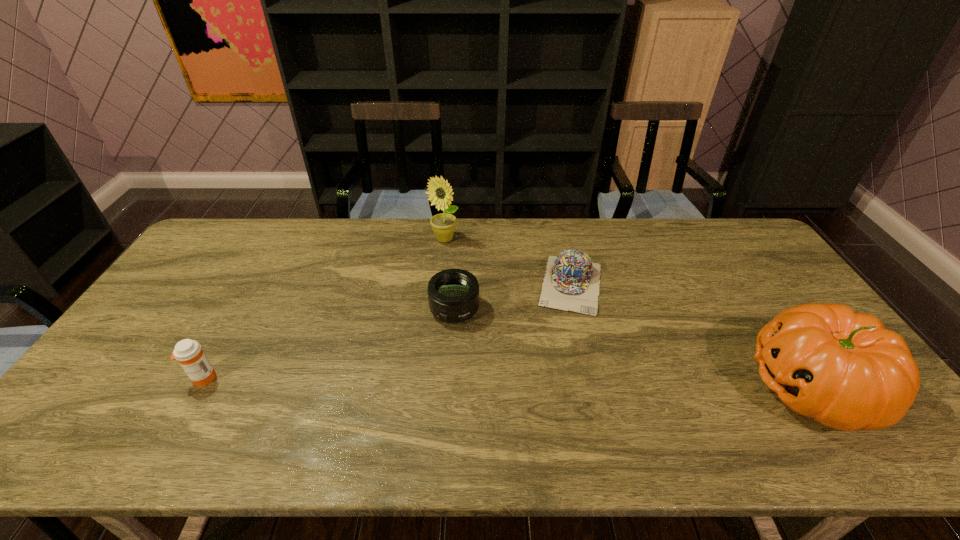
The width and height of the screenshot is (960, 540). I want to click on vacant space situated on the face of the farthest object, so click(443, 303).

Image resolution: width=960 pixels, height=540 pixels. In order to click on cap at the far edge in this screenshot , I will do `click(571, 283)`.

Where is `sunflower present at the far edge`? This screenshot has height=540, width=960. sunflower present at the far edge is located at coordinates (440, 193).

What are the coordinates of `medicine situated at the near edge` in the screenshot? It's located at (189, 353).

Where is `pumpkin positioned at the near edge`? The image size is (960, 540). pumpkin positioned at the near edge is located at coordinates (844, 369).

Where is `object that is positioned at the right edge`? Image resolution: width=960 pixels, height=540 pixels. object that is positioned at the right edge is located at coordinates (844, 369).

Where is `object that is positioned at the near right corner`? This screenshot has width=960, height=540. object that is positioned at the near right corner is located at coordinates (844, 369).

The image size is (960, 540). Find the location of `vacant space at the far edge of the desktop`. vacant space at the far edge of the desktop is located at coordinates (308, 253).

Where is `vacant region at the near edge`? vacant region at the near edge is located at coordinates (482, 401).

This screenshot has width=960, height=540. In the image, there is a desktop. What are the coordinates of `blank space at the left edge` in the screenshot? It's located at (160, 322).